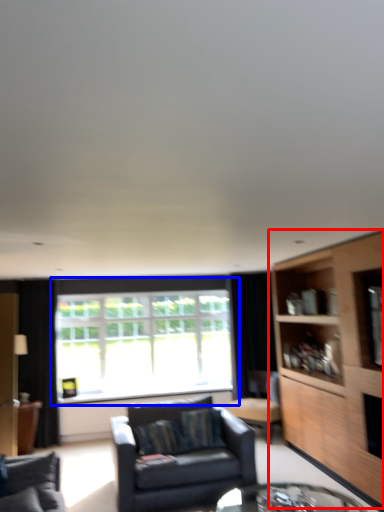
Question: Among these objects, which one is nearest to the camera, cabinetry (highlighted by a red box) or window (highlighted by a blue box)?

Choices:
 (A) cabinetry
 (B) window

Answer: (A)